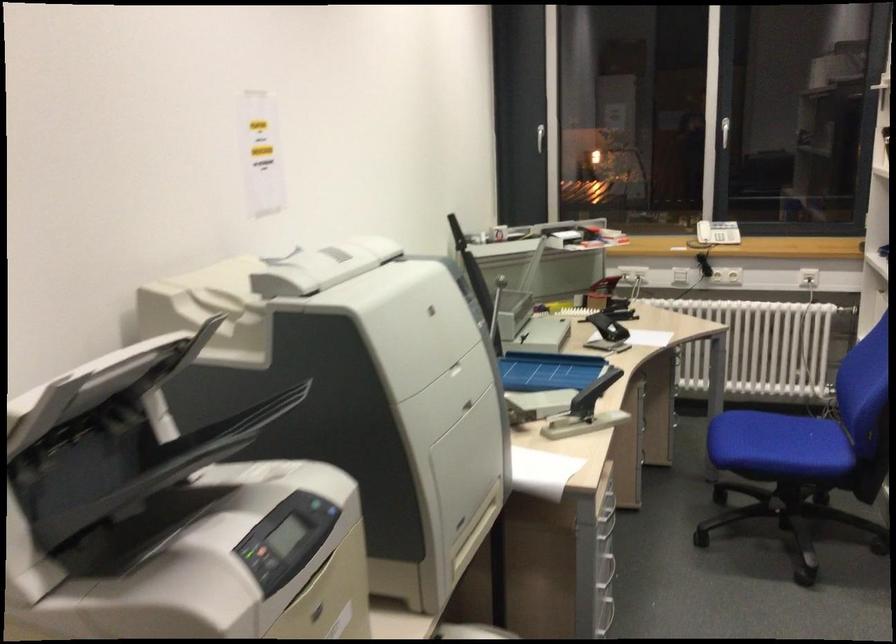
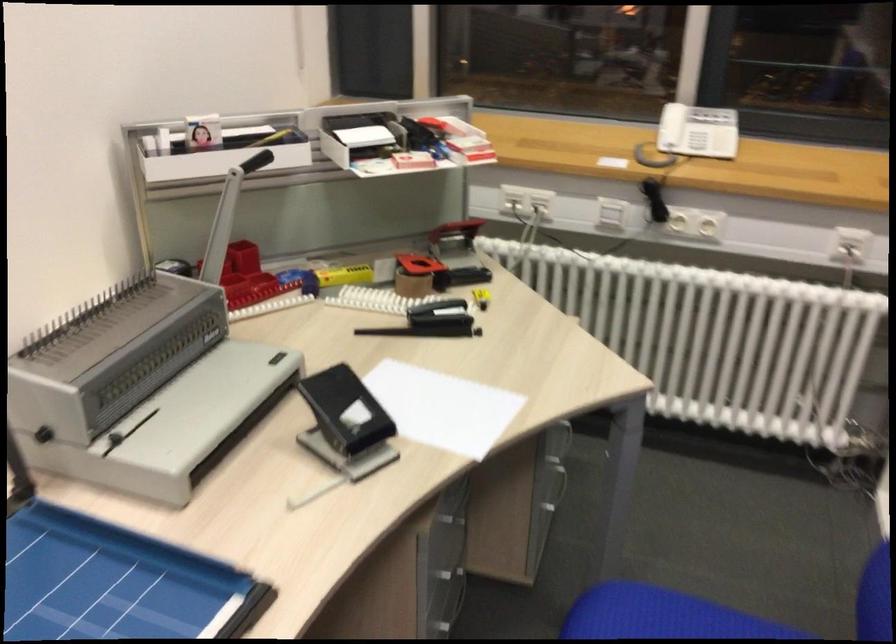
The point at (725, 232) is marked in the first image. Where is the corresponding point in the second image?

(686, 144)